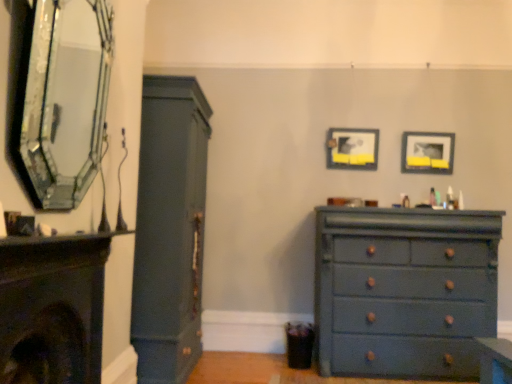
How much space does matte dark blue fireplace at left, which appears as the 1th fireplace when ordered from the bottom, occupy vertically?

70.58 centimeters.

Image resolution: width=512 pixels, height=384 pixels. What do you see at coordinates (352, 148) in the screenshot?
I see `matte black picture frame at upper center, arranged as the second picture frame when viewed from the right` at bounding box center [352, 148].

Measure the distance between matte dark green cabinet at left and camera.

matte dark green cabinet at left and camera are 8.32 feet apart.

Where is `matte dark green cabinet at left`? matte dark green cabinet at left is located at coordinates (170, 229).

This screenshot has width=512, height=384. I want to click on matte dark blue fireplace at left, which appears as the 1th fireplace when ordered from the bottom, so click(52, 309).

Looking at the image, does matte black picture frame at upper center, the 1th picture frame viewed from the left, seem bigger or smaller compared to matte black fireplace at left, the second fireplace in the bottom-to-top sequence?

In the image, matte black picture frame at upper center, the 1th picture frame viewed from the left, appears to be smaller than matte black fireplace at left, the second fireplace in the bottom-to-top sequence.

Can you confirm if matte black picture frame at upper center, arranged as the second picture frame when viewed from the right, is positioned to the right of matte black fireplace at left, the second fireplace in the bottom-to-top sequence?

Yes.

From the picture: Which object is further away from the camera, matte black picture frame at upper center, the 1th picture frame viewed from the left, or matte black fireplace at left, the second fireplace in the bottom-to-top sequence?

matte black picture frame at upper center, the 1th picture frame viewed from the left, is further from the camera.

Does matte black picture frame at upper center, arranged as the second picture frame when viewed from the right, turn towards matte black fireplace at left, the second fireplace in the bottom-to-top sequence?

No, matte black picture frame at upper center, arranged as the second picture frame when viewed from the right, is not aimed at matte black fireplace at left, the second fireplace in the bottom-to-top sequence.

Measure the distance from matte blue dresser at lower right to matte black picture frame at upper right, the 1th picture frame when ordered from right to left.

matte blue dresser at lower right is 3.30 feet away from matte black picture frame at upper right, the 1th picture frame when ordered from right to left.

Is the depth of matte blue dresser at lower right greater than that of matte black picture frame at upper right, the 1th picture frame when ordered from right to left?

No, matte blue dresser at lower right is in front of matte black picture frame at upper right, the 1th picture frame when ordered from right to left.

Consider the image. Can you tell me how much matte blue dresser at lower right and matte black picture frame at upper right, the 2th picture frame positioned from the left, differ in facing direction?

The angular difference between matte blue dresser at lower right and matte black picture frame at upper right, the 2th picture frame positioned from the left, is 0.6 degrees.

Is matte blue dresser at lower right touching matte black picture frame at upper right, the 1th picture frame when ordered from right to left?

No, matte blue dresser at lower right is not with matte black picture frame at upper right, the 1th picture frame when ordered from right to left.

The width and height of the screenshot is (512, 384). Identify the location of cupboard lying above the matte blue dresser at lower right (from the image's perspective). (170, 229).

Is matte dark green cabinet at left directly adjacent to matte blue dresser at lower right?

There is a gap between matte dark green cabinet at left and matte blue dresser at lower right.

Is matte dark green cabinet at left surrounding matte blue dresser at lower right?

No, matte blue dresser at lower right is not surrounded by matte dark green cabinet at left.

Does point (144, 331) lie behind point (323, 342)?

No, it is not.

Considering the sizes of objects matte black picture frame at upper right, the 2th picture frame positioned from the left, and matte black fireplace at left, the second fireplace in the bottom-to-top sequence, in the image provided, who is smaller, matte black picture frame at upper right, the 2th picture frame positioned from the left, or matte black fireplace at left, the second fireplace in the bottom-to-top sequence,?

matte black picture frame at upper right, the 2th picture frame positioned from the left.

Is matte black fireplace at left, the second fireplace in the bottom-to-top sequence, at the back of matte black picture frame at upper right, the 1th picture frame when ordered from right to left?

No.

Consider the image. From a real-world perspective, is matte black picture frame at upper right, the 1th picture frame when ordered from right to left, over matte black fireplace at left, the second fireplace in the bottom-to-top sequence?

Correct, in the physical world, matte black picture frame at upper right, the 1th picture frame when ordered from right to left, is higher than matte black fireplace at left, the second fireplace in the bottom-to-top sequence.

From the image's perspective, is matte black picture frame at upper right, the 2th picture frame positioned from the left, below matte black fireplace at left, the second fireplace in the bottom-to-top sequence?

Yes, from the image's perspective, matte black picture frame at upper right, the 2th picture frame positioned from the left, is beneath matte black fireplace at left, the second fireplace in the bottom-to-top sequence.

Is matte dark blue fireplace at left, which appears as the 1th fireplace when ordered from the bottom, located outside matte blue dresser at lower right?

Absolutely, matte dark blue fireplace at left, which appears as the 1th fireplace when ordered from the bottom, is external to matte blue dresser at lower right.

From a real-world perspective, is matte dark blue fireplace at left, which appears as the 1th fireplace when ordered from the bottom, above or below matte blue dresser at lower right?

Clearly, from a real-world perspective, matte dark blue fireplace at left, which appears as the 1th fireplace when ordered from the bottom, is above matte blue dresser at lower right.

Is matte dark blue fireplace at left, acting as the 2th fireplace starting from the top, facing towards matte blue dresser at lower right?

No, matte dark blue fireplace at left, acting as the 2th fireplace starting from the top, is not oriented towards matte blue dresser at lower right.

In the image, is matte dark blue fireplace at left, acting as the 2th fireplace starting from the top, positioned in front of or behind matte blue dresser at lower right?

matte dark blue fireplace at left, acting as the 2th fireplace starting from the top, is positioned closer to the viewer than matte blue dresser at lower right.

Is there a large distance between matte dark blue fireplace at left, acting as the 2th fireplace starting from the top, and matte black picture frame at upper center, the 1th picture frame viewed from the left?

That's right, there is a large distance between matte dark blue fireplace at left, acting as the 2th fireplace starting from the top, and matte black picture frame at upper center, the 1th picture frame viewed from the left.

This screenshot has width=512, height=384. What are the coordinates of `the 2nd fireplace directly beneath the matte black picture frame at upper center, arranged as the second picture frame when viewed from the right (from a real-world perspective)` in the screenshot? It's located at (52, 309).

Consider the image. Does matte dark blue fireplace at left, which appears as the 1th fireplace when ordered from the bottom, contain matte black picture frame at upper center, the 1th picture frame viewed from the left?

No, matte black picture frame at upper center, the 1th picture frame viewed from the left, is located outside of matte dark blue fireplace at left, which appears as the 1th fireplace when ordered from the bottom.

Measure the distance from matte dark blue fireplace at left, acting as the 2th fireplace starting from the top, to matte black picture frame at upper center, the 1th picture frame viewed from the left.

They are 7.90 feet apart.

How many degrees apart are the facing directions of matte blue dresser at lower right and matte dark blue fireplace at left, which appears as the 1th fireplace when ordered from the bottom?

90.4 degrees.

Does matte blue dresser at lower right appear on the right side of matte dark blue fireplace at left, which appears as the 1th fireplace when ordered from the bottom?

Correct, you'll find matte blue dresser at lower right to the right of matte dark blue fireplace at left, which appears as the 1th fireplace when ordered from the bottom.

The width and height of the screenshot is (512, 384). In order to click on chest of drawers located on the right of matte dark blue fireplace at left, acting as the 2th fireplace starting from the top in this screenshot , I will do `click(404, 291)`.

From the image's perspective, is matte blue dresser at lower right located above matte dark blue fireplace at left, which appears as the 1th fireplace when ordered from the bottom?

No, from the image's perspective, matte blue dresser at lower right is not on top of matte dark blue fireplace at left, which appears as the 1th fireplace when ordered from the bottom.

What are the coordinates of `the 1st picture frame to the right of the matte black fireplace at left, which is the 1th fireplace in top-to-bottom order, counting from the anchor's position` in the screenshot? It's located at (352, 148).

Where is `chest of drawers in front of the matte black picture frame at upper right, the 2th picture frame positioned from the left`? This screenshot has height=384, width=512. chest of drawers in front of the matte black picture frame at upper right, the 2th picture frame positioned from the left is located at coordinates (404, 291).

Which object lies nearer to the anchor point matte black picture frame at upper right, the 1th picture frame when ordered from right to left, matte black picture frame at upper center, the 1th picture frame viewed from the left, or matte dark green cabinet at left?

matte black picture frame at upper center, the 1th picture frame viewed from the left, is closer to matte black picture frame at upper right, the 1th picture frame when ordered from right to left.

When comparing their distances from matte black fireplace at left, the second fireplace in the bottom-to-top sequence, does matte dark blue fireplace at left, acting as the 2th fireplace starting from the top, or matte dark green cabinet at left seem further?

matte dark green cabinet at left lies further to matte black fireplace at left, the second fireplace in the bottom-to-top sequence, than the other object.

From the image, which object appears to be farther from matte dark blue fireplace at left, which appears as the 1th fireplace when ordered from the bottom, matte black fireplace at left, which is the 1th fireplace in top-to-bottom order, or matte black picture frame at upper center, arranged as the second picture frame when viewed from the right?

The object further to matte dark blue fireplace at left, which appears as the 1th fireplace when ordered from the bottom, is matte black picture frame at upper center, arranged as the second picture frame when viewed from the right.

Considering their positions, is matte black fireplace at left, which is the 1th fireplace in top-to-bottom order, positioned further to matte black picture frame at upper center, arranged as the second picture frame when viewed from the right, than matte black picture frame at upper right, the 2th picture frame positioned from the left?

matte black fireplace at left, which is the 1th fireplace in top-to-bottom order, lies further to matte black picture frame at upper center, arranged as the second picture frame when viewed from the right, than the other object.

From the image, which object appears to be nearer to matte black picture frame at upper center, arranged as the second picture frame when viewed from the right, matte dark blue fireplace at left, acting as the 2th fireplace starting from the top, or matte black picture frame at upper right, the 1th picture frame when ordered from right to left?

matte black picture frame at upper right, the 1th picture frame when ordered from right to left, lies closer to matte black picture frame at upper center, arranged as the second picture frame when viewed from the right, than the other object.

Which object lies nearer to the anchor point matte blue dresser at lower right, matte dark green cabinet at left or matte black picture frame at upper right, the 2th picture frame positioned from the left?

Based on the image, matte black picture frame at upper right, the 2th picture frame positioned from the left, appears to be nearer to matte blue dresser at lower right.

From the image, which object appears to be nearer to matte black picture frame at upper right, the 2th picture frame positioned from the left, matte blue dresser at lower right or matte black picture frame at upper center, arranged as the second picture frame when viewed from the right?

The object closer to matte black picture frame at upper right, the 2th picture frame positioned from the left, is matte black picture frame at upper center, arranged as the second picture frame when viewed from the right.

Which object lies further to the anchor point matte dark green cabinet at left, matte black picture frame at upper right, the 2th picture frame positioned from the left, or matte blue dresser at lower right?

The object further to matte dark green cabinet at left is matte black picture frame at upper right, the 2th picture frame positioned from the left.

At what (x,y) coordinates should I click in order to perform the action: click on chest of drawers between matte dark green cabinet at left and matte black picture frame at upper right, the 2th picture frame positioned from the left. Please return your answer as a coordinate pair (x, y). This screenshot has width=512, height=384. Looking at the image, I should click on (404, 291).

This screenshot has height=384, width=512. I want to click on chest of drawers between matte dark blue fireplace at left, acting as the 2th fireplace starting from the top, and matte black picture frame at upper right, the 1th picture frame when ordered from right to left, so click(x=404, y=291).

Locate an element on the screen. picture frame located between matte dark green cabinet at left and matte blue dresser at lower right in the left-right direction is located at coordinates (352, 148).

Locate an element on the screen. This screenshot has height=384, width=512. picture frame between matte black picture frame at upper center, the 1th picture frame viewed from the left, and matte blue dresser at lower right, in the vertical direction is located at coordinates (426, 152).